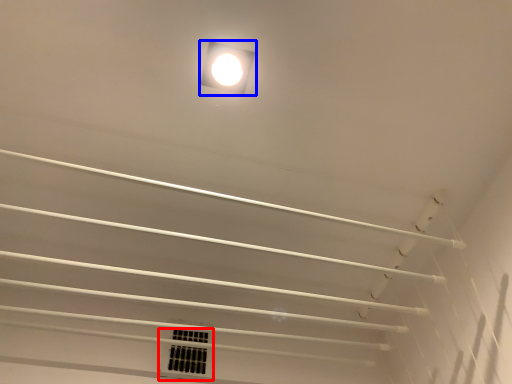
Question: Which object appears closest to the camera in this image, window (highlighted by a red box) or lamp (highlighted by a blue box)?

Choices:
 (A) window
 (B) lamp

Answer: (B)